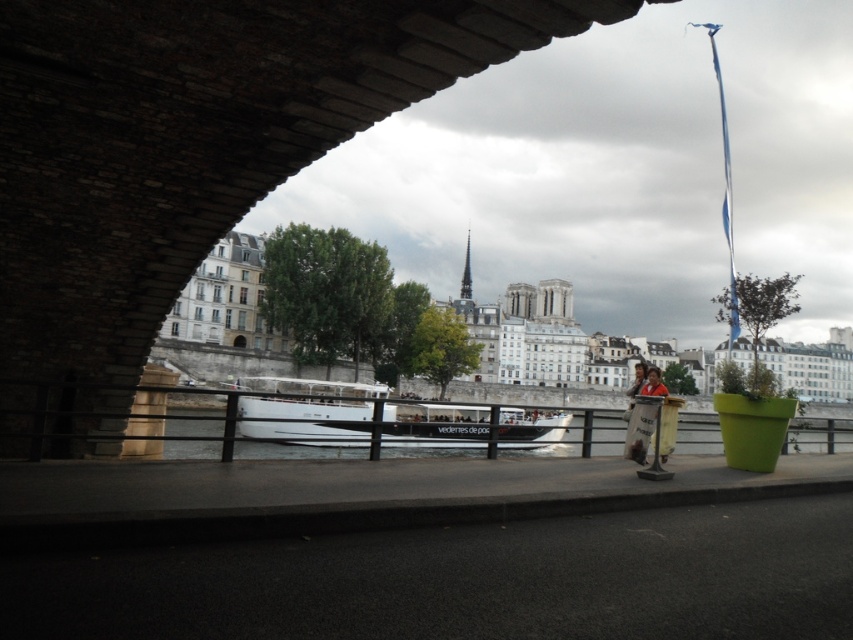
Question: Can you confirm if gray concrete curb at lower center is positioned to the left of white glossy boat at center?

Choices:
 (A) no
 (B) yes

Answer: (A)

Question: Does dark gray stone bridge at upper left appear under gray concrete curb at lower center?

Choices:
 (A) no
 (B) yes

Answer: (A)

Question: Which of the following is the closest to the observer?

Choices:
 (A) white glossy boat at center
 (B) gray concrete curb at lower center
 (C) dark gray stone bridge at upper left

Answer: (C)

Question: Which point is closer to the camera?

Choices:
 (A) [492, 506]
 (B) [399, 22]
 (C) [570, 417]

Answer: (B)

Question: Which object is closer to the camera taking this photo?

Choices:
 (A) gray concrete curb at lower center
 (B) dark gray stone bridge at upper left
 (C) white glossy boat at center

Answer: (B)

Question: Can you confirm if dark gray stone bridge at upper left is wider than white glossy boat at center?

Choices:
 (A) yes
 (B) no

Answer: (B)